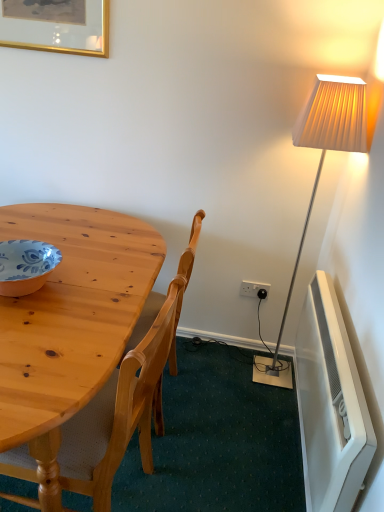
Where is `free space above white plastic radiator at lower right (from a real-world perspective)`? free space above white plastic radiator at lower right (from a real-world perspective) is located at coordinates (350, 340).